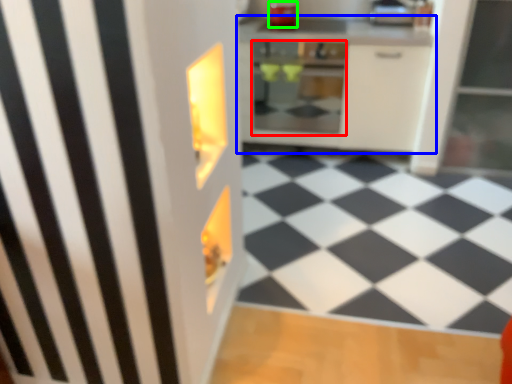
Question: Which object is positioned farthest from oven (highlighted by a red box)? Select from cabinetry (highlighted by a blue box) and appliance (highlighted by a green box).

Choices:
 (A) cabinetry
 (B) appliance

Answer: (B)